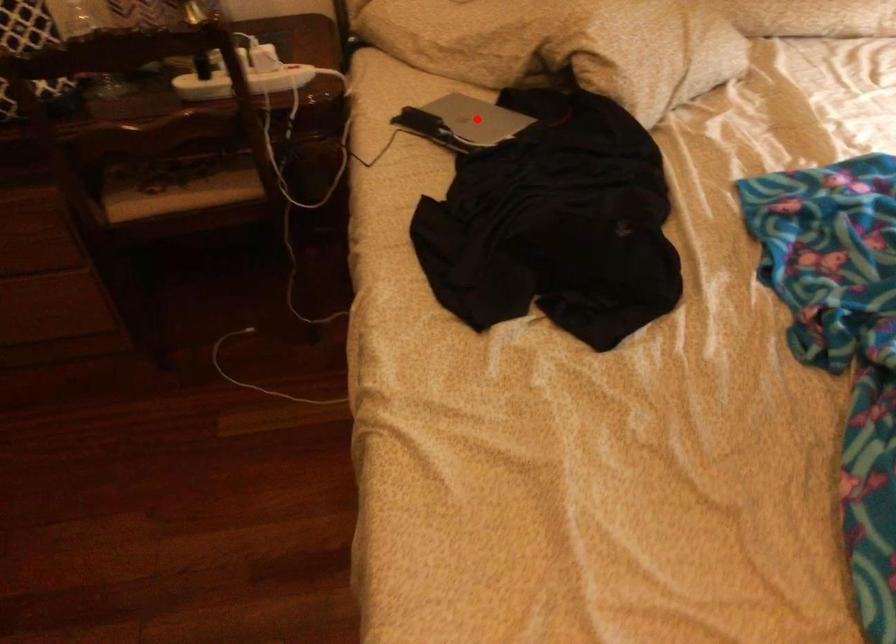
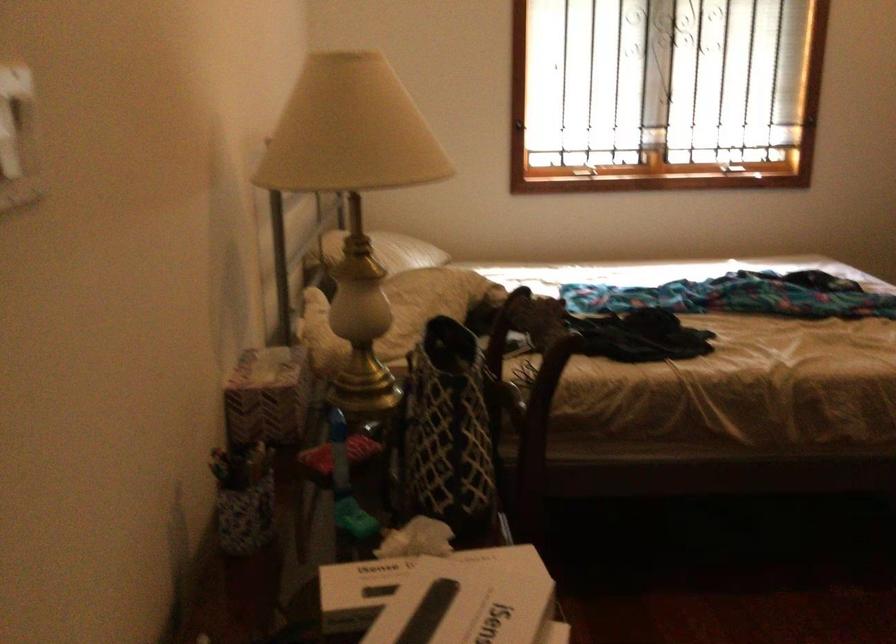
Question: I am providing you with two images of the same scene from different viewpoints. A red point is marked on the first image. Can you still see the location of the red point in image 2?

Choices:
 (A) Yes
 (B) No

Answer: (B)